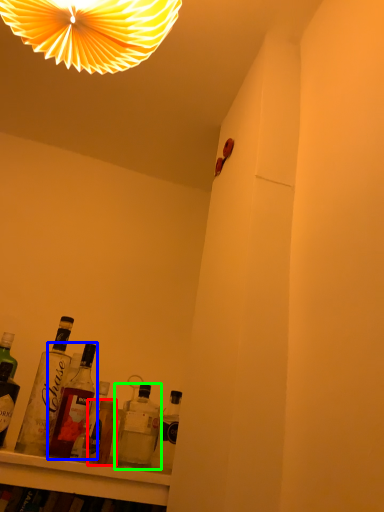
Question: Which is nearer to the bottle (highlighted by a red box)? bottle (highlighted by a blue box) or bottle (highlighted by a green box).

Choices:
 (A) bottle
 (B) bottle

Answer: (B)